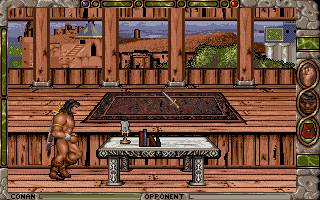
I want to click on table, so click(x=178, y=147).